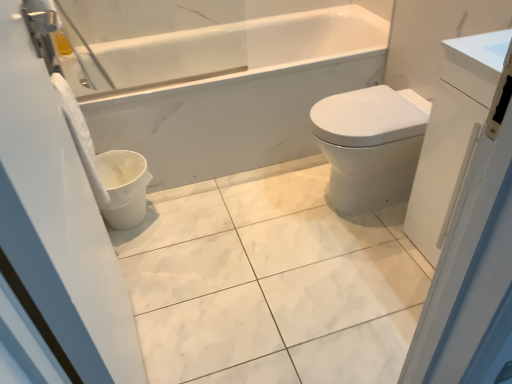
Question: Is white glossy toilet bowl at lower left in contact with white glossy cabinet at right, the 1th screen door positioned from the right?

Choices:
 (A) yes
 (B) no

Answer: (B)

Question: From the image's perspective, is white glossy toilet bowl at lower left above white glossy cabinet at right, which ranks as the second screen door in left-to-right order?

Choices:
 (A) no
 (B) yes

Answer: (A)

Question: Is white glossy toilet bowl at lower left to the left of white glossy cabinet at right, the 1th screen door positioned from the right, from the viewer's perspective?

Choices:
 (A) no
 (B) yes

Answer: (B)

Question: Can you confirm if white glossy toilet bowl at lower left is smaller than white glossy cabinet at right, the 1th screen door positioned from the right?

Choices:
 (A) no
 (B) yes

Answer: (B)

Question: From the image's perspective, would you say white glossy toilet bowl at lower left is shown under white glossy cabinet at right, which ranks as the second screen door in left-to-right order?

Choices:
 (A) no
 (B) yes

Answer: (B)

Question: Is white glossy toilet bowl at lower left wider than white glossy cabinet at right, the 1th screen door positioned from the right?

Choices:
 (A) no
 (B) yes

Answer: (A)

Question: Considering the relative sizes of white glossy cabinet at right, which ranks as the second screen door in left-to-right order, and white marble tile at center in the image provided, is white glossy cabinet at right, which ranks as the second screen door in left-to-right order, thinner than white marble tile at center?

Choices:
 (A) no
 (B) yes

Answer: (B)

Question: Is white glossy cabinet at right, the 1th screen door positioned from the right, not within white marble tile at center?

Choices:
 (A) yes
 (B) no

Answer: (A)

Question: Is white glossy cabinet at right, the 1th screen door positioned from the right, wider than white marble tile at center?

Choices:
 (A) no
 (B) yes

Answer: (A)

Question: Is white glossy cabinet at right, which ranks as the second screen door in left-to-right order, surrounding white marble tile at center?

Choices:
 (A) no
 (B) yes

Answer: (A)

Question: Is white glossy cabinet at right, the 1th screen door positioned from the right, smaller than white marble tile at center?

Choices:
 (A) yes
 (B) no

Answer: (B)

Question: From the image's perspective, is white glossy cabinet at right, the 1th screen door positioned from the right, on top of white marble tile at center?

Choices:
 (A) yes
 (B) no

Answer: (A)

Question: From the image's perspective, is white glossy bidet at right located above white marble tile at center?

Choices:
 (A) no
 (B) yes

Answer: (B)